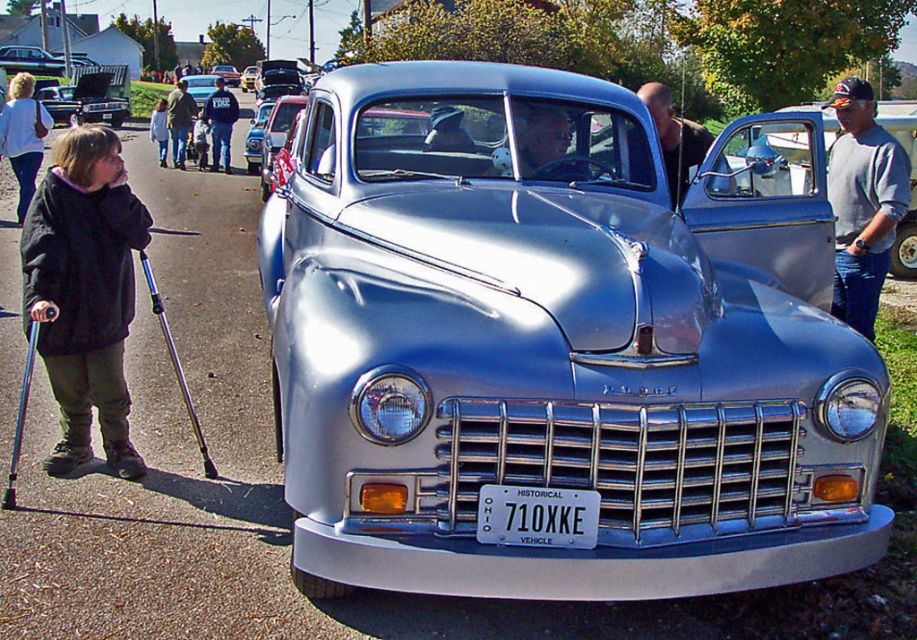
You are a photographer setting up a shoot near the vintage car. You want to position the denim jacket at upper center so it appears in front of the brushed metal truck at upper left in the photo. Is this possible based on their current positions?

The denim jacket at upper center is currently behind the brushed metal truck at upper left, so it cannot be seen in front of it without moving either object.

You are a photographer planning to take a portrait of the vintage car and the child. You need to ensure both the brushed metal truck at upper left and the denim jacket at upper center are visible in the frame. Given their height difference, which object should you position closer to the camera to maintain both in focus?

The brushed metal truck at upper left is taller than the denim jacket at upper center. To keep both in focus, position the denim jacket at upper center closer to the camera so its size in the frame matches the height of the truck.